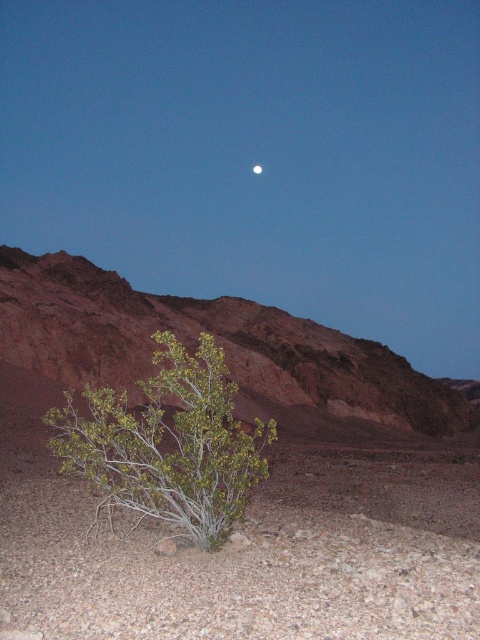
Question: Among these points, which one is nearest to the camera?

Choices:
 (A) (152, 458)
 (B) (256, 164)
 (C) (336, 77)

Answer: (A)

Question: Does green leafy shrub at lower left have a smaller size compared to silvery reflective moon at upper center?

Choices:
 (A) yes
 (B) no

Answer: (B)

Question: Is green leafy bush at lower center below silvery reflective moon at upper center?

Choices:
 (A) no
 (B) yes

Answer: (A)

Question: Which object is the closest to the green leafy shrub at lower left?

Choices:
 (A) silvery reflective moon at upper center
 (B) green leafy bush at lower center

Answer: (B)

Question: Can you confirm if green leafy shrub at lower left is smaller than silvery reflective moon at upper center?

Choices:
 (A) yes
 (B) no

Answer: (B)

Question: Which is farther from the silvery reflective moon at upper center?

Choices:
 (A) green leafy shrub at lower left
 (B) green leafy bush at lower center

Answer: (A)